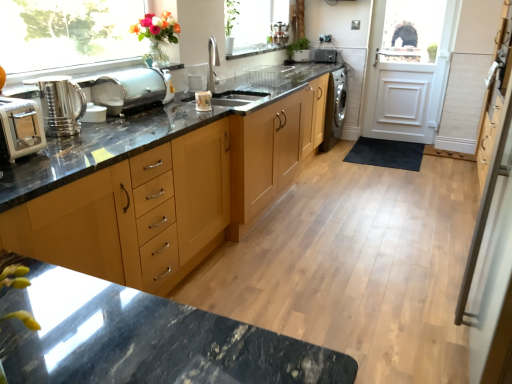
Question: From a real-world perspective, is clear glass window at upper left under glossy ceramic mug at upper center, which ranks as the 2th appliance in right-to-left order?

Choices:
 (A) no
 (B) yes

Answer: (A)

Question: Is clear glass window at upper left at the left side of glossy ceramic mug at upper center, the second appliance in the left-to-right sequence?

Choices:
 (A) no
 (B) yes

Answer: (B)

Question: From the image's perspective, does clear glass window at upper left appear lower than glossy ceramic mug at upper center, which is counted as the third appliance, starting from the top?

Choices:
 (A) no
 (B) yes

Answer: (A)

Question: From a real-world perspective, is clear glass window at upper left on top of glossy ceramic mug at upper center, which ranks as the 2th appliance in right-to-left order?

Choices:
 (A) yes
 (B) no

Answer: (A)

Question: Does clear glass window at upper left have a greater width compared to glossy ceramic mug at upper center, marked as the second appliance in a front-to-back arrangement?

Choices:
 (A) yes
 (B) no

Answer: (A)

Question: Considering the relative sizes of clear glass window at upper left and glossy ceramic mug at upper center, the second appliance in the left-to-right sequence, in the image provided, is clear glass window at upper left bigger than glossy ceramic mug at upper center, the second appliance in the left-to-right sequence,?

Choices:
 (A) no
 (B) yes

Answer: (B)

Question: Could you tell me if light wood cabinet at center is facing satin black camera at center, which is the third appliance from front to back?

Choices:
 (A) no
 (B) yes

Answer: (A)

Question: Considering the relative sizes of light wood cabinet at center and satin black camera at center, which is counted as the 1th appliance, starting from the top, in the image provided, is light wood cabinet at center bigger than satin black camera at center, which is counted as the 1th appliance, starting from the top,?

Choices:
 (A) no
 (B) yes

Answer: (B)

Question: Is light wood cabinet at center not inside satin black camera at center, which is counted as the 1th appliance, starting from the top?

Choices:
 (A) yes
 (B) no

Answer: (A)

Question: Would you say light wood cabinet at center is a long distance from satin black camera at center, which is the third appliance from front to back?

Choices:
 (A) yes
 (B) no

Answer: (A)

Question: From the image's perspective, is light wood cabinet at center below satin black camera at center, arranged as the third appliance when ordered from the bottom?

Choices:
 (A) no
 (B) yes

Answer: (B)

Question: Could satin black camera at center, which is counted as the 1th appliance, starting from the top, be considered to be inside light wood cabinet at center?

Choices:
 (A) yes
 (B) no

Answer: (B)

Question: Is silver metallic screen door at right next to light wood cabinet at center?

Choices:
 (A) no
 (B) yes

Answer: (A)